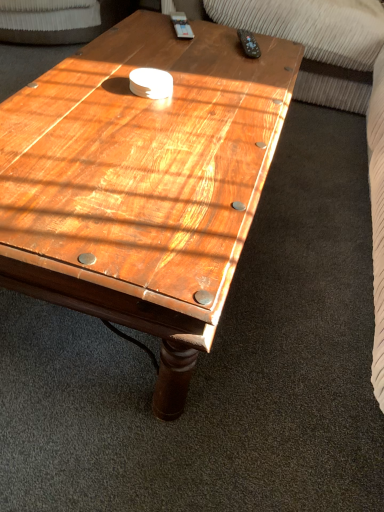
Question: Is black plastic remote at upper right not within wooden coffee table at center?

Choices:
 (A) yes
 (B) no

Answer: (B)

Question: Is black plastic remote at upper right to the left of wooden coffee table at center from the viewer's perspective?

Choices:
 (A) no
 (B) yes

Answer: (A)

Question: Considering the relative sizes of black plastic remote at upper right and wooden coffee table at center in the image provided, is black plastic remote at upper right bigger than wooden coffee table at center?

Choices:
 (A) no
 (B) yes

Answer: (A)

Question: Does black plastic remote at upper right have a greater width compared to wooden coffee table at center?

Choices:
 (A) yes
 (B) no

Answer: (B)

Question: Are black plastic remote at upper right and wooden coffee table at center beside each other?

Choices:
 (A) no
 (B) yes

Answer: (A)

Question: Is black plastic remote at upper right shorter than wooden coffee table at center?

Choices:
 (A) yes
 (B) no

Answer: (A)

Question: Is wooden coffee table at center wider than black plastic remote at upper right?

Choices:
 (A) yes
 (B) no

Answer: (A)

Question: Is there a large distance between wooden coffee table at center and black plastic remote at upper right?

Choices:
 (A) yes
 (B) no

Answer: (B)

Question: From the image's perspective, would you say wooden coffee table at center is shown under black plastic remote at upper right?

Choices:
 (A) no
 (B) yes

Answer: (B)

Question: Is wooden coffee table at center turned away from black plastic remote at upper right?

Choices:
 (A) no
 (B) yes

Answer: (A)

Question: Is wooden coffee table at center thinner than black plastic remote at upper right?

Choices:
 (A) no
 (B) yes

Answer: (A)

Question: Is wooden coffee table at center not inside black plastic remote at upper right?

Choices:
 (A) yes
 (B) no

Answer: (A)

Question: Based on their sizes in the image, would you say black plastic remote at upper right is bigger or smaller than wooden coffee table at center?

Choices:
 (A) small
 (B) big

Answer: (A)